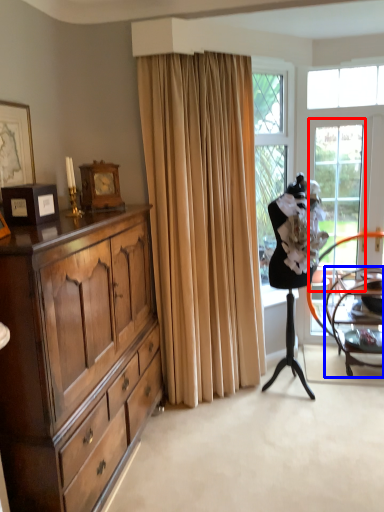
Question: Which object is closer to the camera taking this photo, screen door (highlighted by a red box) or chair (highlighted by a blue box)?

Choices:
 (A) screen door
 (B) chair

Answer: (B)